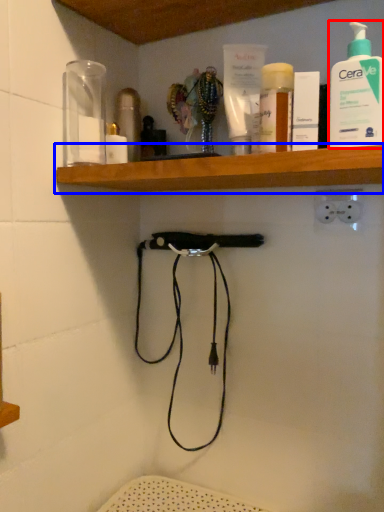
Question: Which object appears closest to the camera in this image, cleaning product (highlighted by a red box) or shelf (highlighted by a blue box)?

Choices:
 (A) cleaning product
 (B) shelf

Answer: (B)